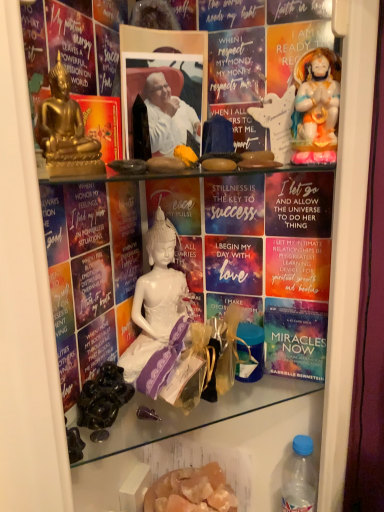
Question: Is gold polished buddha statue at upper left, which is the first person from front to back, facing towards translucent orange crystals at lower center, which ranks as the first food in right-to-left order?

Choices:
 (A) no
 (B) yes

Answer: (A)

Question: Is gold polished buddha statue at upper left, which is the first person from front to back, positioned beyond the bounds of translucent orange crystals at lower center, marked as the first food in a back-to-front arrangement?

Choices:
 (A) no
 (B) yes

Answer: (B)

Question: Is gold polished buddha statue at upper left, the 1th person in the left-to-right sequence, positioned with its back to translucent orange crystals at lower center, the 2th food from the top?

Choices:
 (A) no
 (B) yes

Answer: (A)

Question: Is translucent orange crystals at lower center, marked as the first food in a back-to-front arrangement, located within gold polished buddha statue at upper left, which is the first person from front to back?

Choices:
 (A) yes
 (B) no

Answer: (B)

Question: Does gold polished buddha statue at upper left, which is the first person from front to back, have a lesser width compared to translucent orange crystals at lower center, marked as the second food in a front-to-back arrangement?

Choices:
 (A) yes
 (B) no

Answer: (A)

Question: Is gold polished buddha statue at upper left, which is the first person from front to back, placed right next to translucent orange crystals at lower center, the 2th food from the top?

Choices:
 (A) yes
 (B) no

Answer: (B)

Question: Is purple satin dress at center positioned beyond the bounds of white porcelain statue at upper right?

Choices:
 (A) yes
 (B) no

Answer: (A)

Question: Can you confirm if purple satin dress at center is smaller than white porcelain statue at upper right?

Choices:
 (A) no
 (B) yes

Answer: (A)

Question: Is the position of purple satin dress at center less distant than that of white porcelain statue at upper right?

Choices:
 (A) no
 (B) yes

Answer: (B)

Question: Is purple satin dress at center facing towards white porcelain statue at upper right?

Choices:
 (A) no
 (B) yes

Answer: (A)

Question: Considering the relative positions of purple satin dress at center and white porcelain statue at upper right in the image provided, is purple satin dress at center behind white porcelain statue at upper right?

Choices:
 (A) yes
 (B) no

Answer: (B)

Question: From the image's perspective, is purple satin dress at center on white porcelain statue at upper right?

Choices:
 (A) no
 (B) yes

Answer: (A)

Question: From the image's perspective, does black glossy grapes at lower left, marked as the first food in a left-to-right arrangement, appear higher than translucent orange crystals at lower center, which ranks as the first food in bottom-to-top order?

Choices:
 (A) no
 (B) yes

Answer: (B)